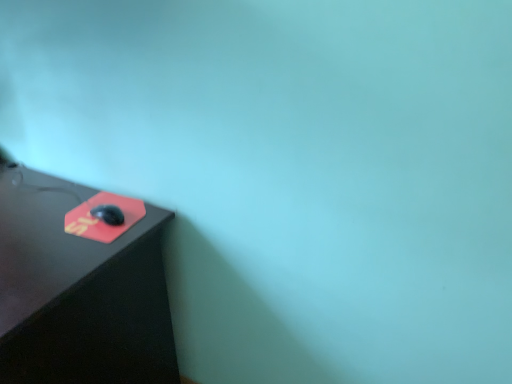
Identify the location of black matte table at lower left. The image size is (512, 384). (79, 291).

What do you see at coordinates (79, 291) in the screenshot? This screenshot has width=512, height=384. I see `black matte table at lower left` at bounding box center [79, 291].

The height and width of the screenshot is (384, 512). I want to click on black matte table at lower left, so click(x=79, y=291).